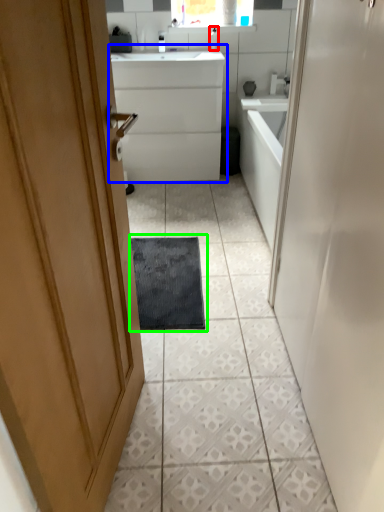
Question: Which is nearer to the toiletry (highlighted by a red box)? bathroom cabinet (highlighted by a blue box) or bath mat (highlighted by a green box).

Choices:
 (A) bathroom cabinet
 (B) bath mat

Answer: (A)